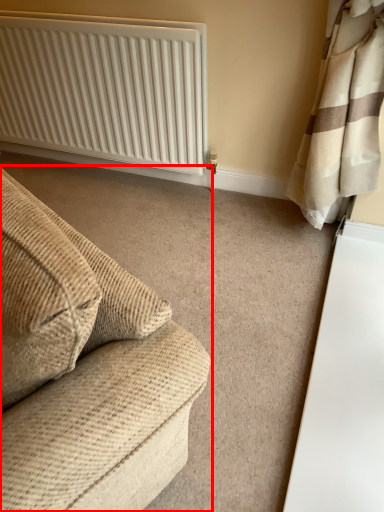
Question: Where is studio couch (annotated by the red box) located in relation to radiator in the image?

Choices:
 (A) left
 (B) right

Answer: (B)